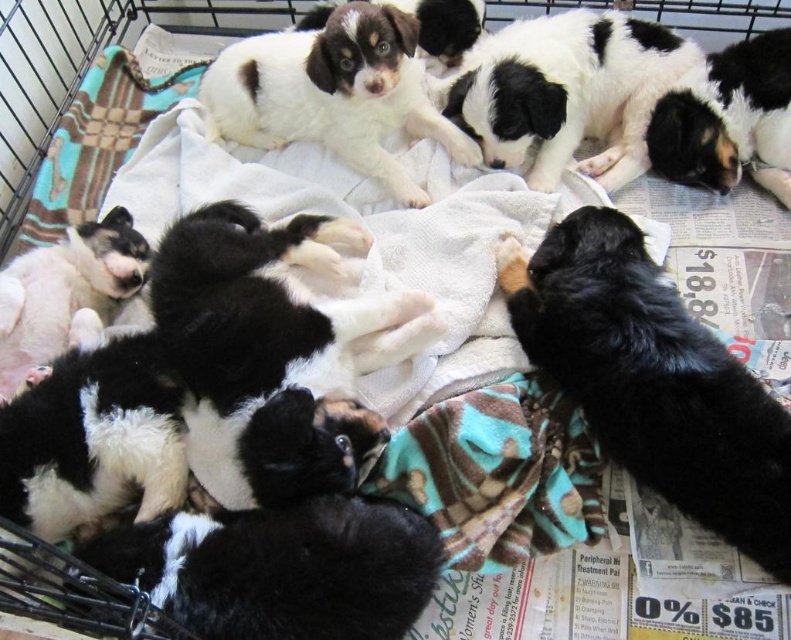
Where is `black soft fur at center`? Image resolution: width=791 pixels, height=640 pixels. black soft fur at center is located at coordinates (275, 353).

Is black soft fur at center below black and white fur at upper center?

Yes.

The image size is (791, 640). I want to click on black soft fur at center, so click(x=275, y=353).

Does black and white fur at upper center lie in front of white soft fur puppy at upper center?

No, black and white fur at upper center is further to the viewer.

Is point (559, 157) farther from camera compared to point (216, 106)?

No, (559, 157) is in front of (216, 106).

Who is more distant from viewer, (596, 164) or (415, 81)?

The point (415, 81) is behind.

The image size is (791, 640). What are the coordinates of `black and white fur at upper center` in the screenshot? It's located at (566, 92).

Is point (315, 451) positioned in front of point (346, 51)?

Yes, point (315, 451) is in front of point (346, 51).

Describe the element at coordinates (275, 353) in the screenshot. I see `black soft fur at center` at that location.

You are a GUI agent. You are given a task and a screenshot of the screen. Output one action in this format:
    pyautogui.click(x=<x>, y=<y>)
    Task: Click on the black soft fur at center
    
    Given the screenshot: What is the action you would take?
    pyautogui.click(x=275, y=353)

At what (x,y) coordinates should I click in order to perform the action: click on black soft fur at center. Please return your answer as a coordinate pair (x, y). Image resolution: width=791 pixels, height=640 pixels. Looking at the image, I should click on (275, 353).